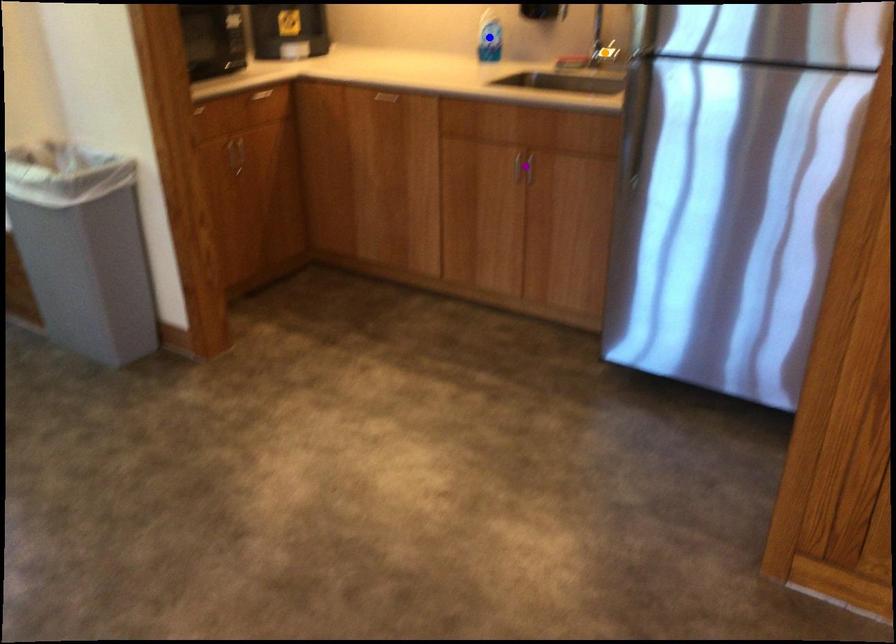
Order these from nearest to farthest:
1. blue point
2. orange point
3. purple point

blue point, orange point, purple point